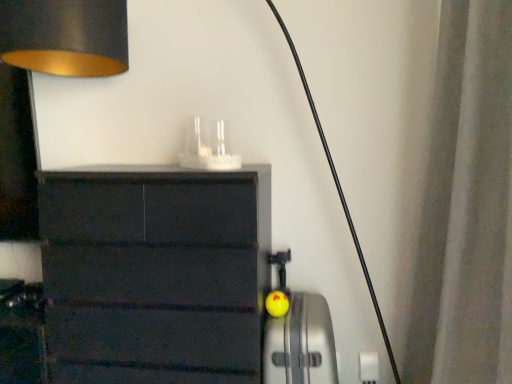
Question: From a real-world perspective, is yellow rubber ball at center beneath white fabric curtain at right?

Choices:
 (A) no
 (B) yes

Answer: (B)

Question: Is yellow rubber ball at center directly adjacent to white fabric curtain at right?

Choices:
 (A) no
 (B) yes

Answer: (A)

Question: Does yellow rubber ball at center have a lesser height compared to white fabric curtain at right?

Choices:
 (A) no
 (B) yes

Answer: (B)

Question: Is yellow rubber ball at center oriented towards white fabric curtain at right?

Choices:
 (A) no
 (B) yes

Answer: (A)

Question: Is white fabric curtain at right a part of yellow rubber ball at center?

Choices:
 (A) yes
 (B) no

Answer: (B)

Question: Considering the relative sizes of yellow rubber ball at center and white fabric curtain at right in the image provided, is yellow rubber ball at center smaller than white fabric curtain at right?

Choices:
 (A) no
 (B) yes

Answer: (B)

Question: Is the depth of white fabric curtain at right greater than that of yellow rubber ball at center?

Choices:
 (A) yes
 (B) no

Answer: (B)

Question: Is white fabric curtain at right taller than yellow rubber ball at center?

Choices:
 (A) no
 (B) yes

Answer: (B)

Question: Is the position of white fabric curtain at right less distant than that of yellow rubber ball at center?

Choices:
 (A) no
 (B) yes

Answer: (B)

Question: Does white fabric curtain at right contain yellow rubber ball at center?

Choices:
 (A) no
 (B) yes

Answer: (A)

Question: Is white fabric curtain at right positioned with its back to yellow rubber ball at center?

Choices:
 (A) no
 (B) yes

Answer: (B)

Question: From a real-world perspective, is white fabric curtain at right located higher than yellow rubber ball at center?

Choices:
 (A) yes
 (B) no

Answer: (A)

Question: Which is correct: yellow rubber ball at center is inside white fabric curtain at right, or outside of it?

Choices:
 (A) outside
 (B) inside

Answer: (A)